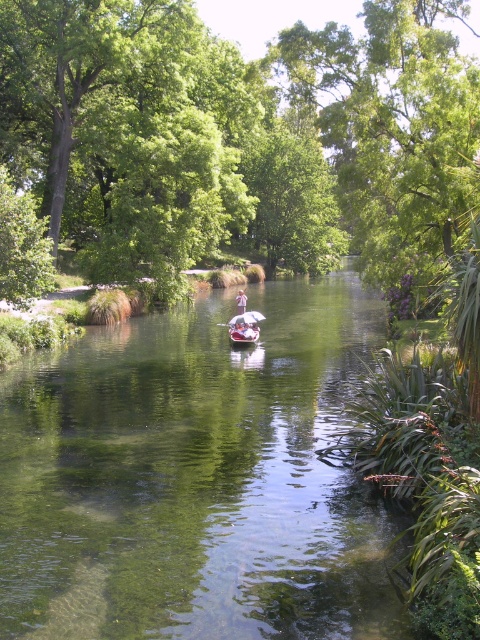
You are planning to cross the river in a boat that requires a minimum width of 1.5 meters to accommodate your equipment. Based on the scene, can the metallic silver kayak at center and the pink fabric person at center both fit inside the kayak simultaneously?

The metallic silver kayak at center is narrower than the pink fabric person at center, so it cannot accommodate both the kayak and the person at the same time.

You are a photographer planning to take a photo of the metallic silver kayak at center in the serene river scene. The coordinates provided are point (244,328). Can you confirm if this point accurately represents the position of the metallic silver kayak at center?

Yes, the point (244,328) corresponds to the metallic silver kayak at center, so it accurately represents its position.

You are standing on the riverbank and see the clear water at center and the pink fabric person at center. Which object is closer to you?

The clear water at center is closer to you because it is in front of the pink fabric person at center.